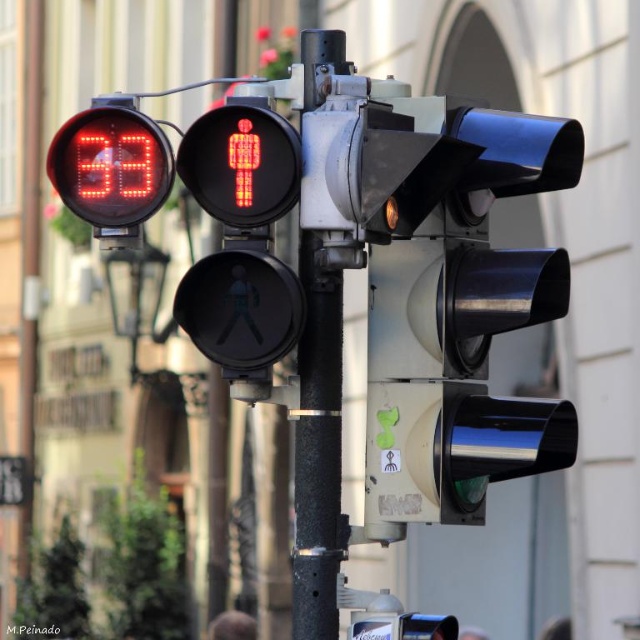
Question: Which point is closer to the camera?

Choices:
 (A) metallic rectangular sign at lower left
 (B) black metal pole at center

Answer: (B)

Question: Considering the real-world distances, which object is farthest from the red led display at upper left?

Choices:
 (A) metallic rectangular sign at lower left
 (B) metallic traffic light at center

Answer: (A)

Question: Can you confirm if metallic traffic light at center is positioned above black metal pole at center?

Choices:
 (A) no
 (B) yes

Answer: (B)

Question: Does metallic traffic light at center have a lesser width compared to metallic rectangular sign at lower left?

Choices:
 (A) yes
 (B) no

Answer: (B)

Question: Does black metal pole at center have a greater width compared to metallic rectangular sign at lower left?

Choices:
 (A) yes
 (B) no

Answer: (B)

Question: Which of these objects is positioned closest to the black metal pole at center?

Choices:
 (A) metallic rectangular sign at lower left
 (B) red led display at upper left
 (C) metallic traffic light at center

Answer: (C)